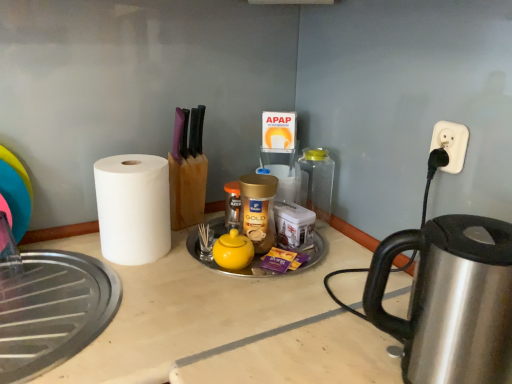
What do you see at coordinates (133, 208) in the screenshot? I see `white matte paper towel at left` at bounding box center [133, 208].

Where is `transparent glass jar at center`? This screenshot has height=384, width=512. transparent glass jar at center is located at coordinates (316, 182).

Is point (426, 334) closer to viewer compared to point (307, 193)?

Yes, it is.

Is satin silver kettle at right placed right next to transparent glass jar at center?

There is a gap between satin silver kettle at right and transparent glass jar at center.

From the image's perspective, which one is positioned lower, satin silver kettle at right or transparent glass jar at center?

satin silver kettle at right is shown below in the image.

Is satin silver kettle at right at the left side of transparent glass jar at center?

No, satin silver kettle at right is not to the left of transparent glass jar at center.

Is point (139, 217) closer or farther from the camera than point (459, 149)?

Point (139, 217) is positioned farther from the camera compared to point (459, 149).

From the picture: Can you confirm if white matte paper towel at left is positioned to the right of white plastic outlet at upper right?

In fact, white matte paper towel at left is to the left of white plastic outlet at upper right.

Could you tell me if white matte paper towel at left is facing white plastic outlet at upper right?

No, white matte paper towel at left is not turned towards white plastic outlet at upper right.

Could white plastic outlet at upper right be considered to be inside white matte paper towel at left?

No, white plastic outlet at upper right is not inside white matte paper towel at left.

From the image's perspective, which is above, white matte paper towel at left or yellow matte tea pot at center?

white matte paper towel at left.

Is point (155, 243) positioned after point (248, 251)?

Yes, it is behind point (248, 251).

Between white matte paper towel at left and yellow matte tea pot at center, which one has smaller width?

yellow matte tea pot at center is thinner.

From the image's perspective, between transparent glass jar at center and satin silver kettle at right, which one is located above?

transparent glass jar at center.

Can you confirm if transparent glass jar at center is positioned to the right of satin silver kettle at right?

Incorrect, transparent glass jar at center is not on the right side of satin silver kettle at right.

How many degrees apart are the facing directions of transparent glass jar at center and satin silver kettle at right?

51.5 degrees.

Is transparent glass jar at center touching satin silver kettle at right?

transparent glass jar at center is not next to satin silver kettle at right, and they're not touching.

Does white matte paper towel at left have a smaller size compared to transparent glass jar at center?

No, white matte paper towel at left is not smaller than transparent glass jar at center.

Does white matte paper towel at left come behind transparent glass jar at center?

No.

Who is shorter, white matte paper towel at left or transparent glass jar at center?

transparent glass jar at center is shorter.

Considering the sizes of objects yellow matte tea pot at center and satin silver kettle at right in the image provided, who is bigger, yellow matte tea pot at center or satin silver kettle at right?

satin silver kettle at right is bigger.

Is yellow matte tea pot at center located outside satin silver kettle at right?

Yes, yellow matte tea pot at center is outside of satin silver kettle at right.

Which of these two, yellow matte tea pot at center or satin silver kettle at right, is wider?

Wider between the two is satin silver kettle at right.

Could you tell me if yellow matte tea pot at center is facing satin silver kettle at right?

No, yellow matte tea pot at center is not facing towards satin silver kettle at right.

Where is `paper towel above the yellow matte tea pot at center (from the image's perspective)`? The width and height of the screenshot is (512, 384). paper towel above the yellow matte tea pot at center (from the image's perspective) is located at coordinates (133, 208).

Consider the image. From the image's perspective, is yellow matte tea pot at center under white matte paper towel at left?

Correct, yellow matte tea pot at center appears lower than white matte paper towel at left in the image.

From a real-world perspective, which object rests below the other?

From a 3D spatial view, yellow matte tea pot at center is below.

Is point (229, 263) closer to camera compared to point (101, 194)?

Yes, it is in front of point (101, 194).

In order to click on kettle that appears on the right of transparent glass jar at center in this screenshot , I will do `click(450, 301)`.

Where is `paper towel that is below the white plastic outlet at upper right (from the image's perspective)`? paper towel that is below the white plastic outlet at upper right (from the image's perspective) is located at coordinates (133, 208).

Which object lies nearer to the anchor point yellow matte tea pot at center, satin silver kettle at right or white plastic outlet at upper right?

satin silver kettle at right is closer to yellow matte tea pot at center.

Which object lies nearer to the anchor point transparent glass jar at center, yellow matte tea pot at center or white matte paper towel at left?

yellow matte tea pot at center lies closer to transparent glass jar at center than the other object.

Estimate the real-world distances between objects in this image. Which object is further from transparent glass jar at center, yellow matte tea pot at center or white plastic outlet at upper right?

The object further to transparent glass jar at center is white plastic outlet at upper right.

Consider the image. From the image, which object appears to be nearer to yellow matte tea pot at center, white plastic outlet at upper right or satin silver kettle at right?

satin silver kettle at right.

When comparing their distances from white matte paper towel at left, does transparent glass jar at center or yellow matte tea pot at center seem further?

Based on the image, transparent glass jar at center appears to be further to white matte paper towel at left.

Estimate the real-world distances between objects in this image. Which object is further from white matte paper towel at left, satin silver kettle at right or transparent glass jar at center?

satin silver kettle at right is positioned further to the anchor white matte paper towel at left.

Which object lies nearer to the anchor point satin silver kettle at right, white matte paper towel at left or yellow matte tea pot at center?

Among the two, yellow matte tea pot at center is located nearer to satin silver kettle at right.

Estimate the real-world distances between objects in this image. Which object is further from satin silver kettle at right, transparent glass jar at center or white plastic outlet at upper right?

transparent glass jar at center is further to satin silver kettle at right.

Identify the location of electric outlet between satin silver kettle at right and transparent glass jar at center from front to back. The height and width of the screenshot is (384, 512). (451, 144).

At what (x,y) coordinates should I click in order to perform the action: click on paper towel located between satin silver kettle at right and transparent glass jar at center in the depth direction. Please return your answer as a coordinate pair (x, y). The image size is (512, 384). Looking at the image, I should click on (133, 208).

At what (x,y) coordinates should I click in order to perform the action: click on tea pot situated between white matte paper towel at left and transparent glass jar at center from left to right. Please return your answer as a coordinate pair (x, y). The image size is (512, 384). Looking at the image, I should click on (233, 250).

I want to click on bottle between white matte paper towel at left and white plastic outlet at upper right from left to right, so click(316, 182).